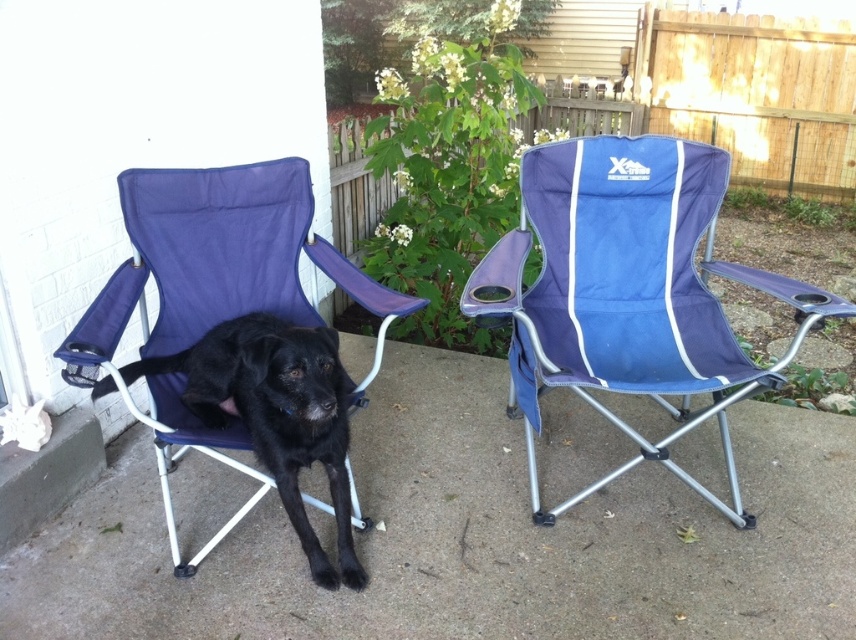
Who is more distant from viewer, (188,326) or (260,426)?

Point (188,326)

Based on the photo, does navy blue fabric chair at left appear on the right side of black matte dog at left?

Incorrect, navy blue fabric chair at left is not on the right side of black matte dog at left.

This screenshot has width=856, height=640. What do you see at coordinates (218, 260) in the screenshot?
I see `navy blue fabric chair at left` at bounding box center [218, 260].

Image resolution: width=856 pixels, height=640 pixels. Identify the location of navy blue fabric chair at left. (218, 260).

Between blue fabric folding chair at center and black matte dog at left, which one appears on the left side from the viewer's perspective?

black matte dog at left is more to the left.

This screenshot has height=640, width=856. Find the location of `blue fabric folding chair at center`. blue fabric folding chair at center is located at coordinates (627, 292).

Does blue fabric folding chair at center have a lesser width compared to navy blue fabric chair at left?

Incorrect, blue fabric folding chair at center's width is not less than navy blue fabric chair at left's.

Measure the distance between blue fabric folding chair at center and navy blue fabric chair at left.

The distance of blue fabric folding chair at center from navy blue fabric chair at left is 28.43 inches.

Find the location of `blue fabric folding chair at center`. blue fabric folding chair at center is located at coordinates (627, 292).

Locate an element on the screen. blue fabric folding chair at center is located at coordinates (627, 292).